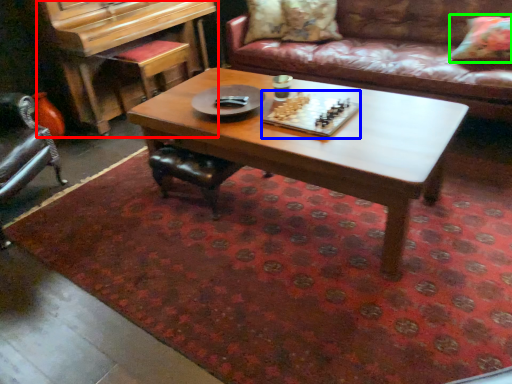
Question: Estimate the real-world distances between objects in this image. Which object is closer to piano (highlighted by a red box), board game (highlighted by a blue box) or pillow (highlighted by a green box)?

Choices:
 (A) board game
 (B) pillow

Answer: (A)